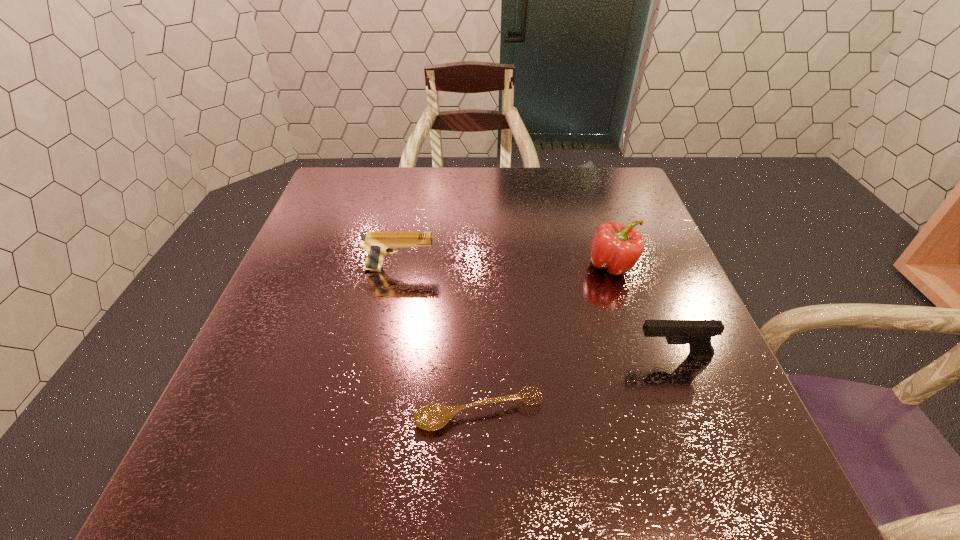
The height and width of the screenshot is (540, 960). I want to click on vacant area situated 0.310m on the front-facing side of the nearer pistol, so point(471,356).

Where is `free spot located 0.140m on the back of the shortest object`? free spot located 0.140m on the back of the shortest object is located at coordinates (479, 332).

Identify the location of pepper located in the right edge section of the desktop. (616, 248).

Find the location of a particular element. The width and height of the screenshot is (960, 540). pistol present at the right edge is located at coordinates (698, 333).

You are a GUI agent. You are given a task and a screenshot of the screen. Output one action in this format:
    pyautogui.click(x=<x>, y=<y>)
    Task: Click on the free space at the far edge of the desktop
    
    Given the screenshot: What is the action you would take?
    pyautogui.click(x=539, y=184)

Where is `vacant space at the near edge of the desktop`? The width and height of the screenshot is (960, 540). vacant space at the near edge of the desktop is located at coordinates (671, 505).

The height and width of the screenshot is (540, 960). I want to click on free space at the left edge of the desktop, so click(305, 299).

Locate an element on the screen. This screenshot has width=960, height=540. vacant space at the right edge of the desktop is located at coordinates (675, 274).

Where is `vacant region at the far left corner of the desktop`? The height and width of the screenshot is (540, 960). vacant region at the far left corner of the desktop is located at coordinates (374, 172).

Where is `vacant space at the near left corner of the desktop`? This screenshot has width=960, height=540. vacant space at the near left corner of the desktop is located at coordinates (269, 505).